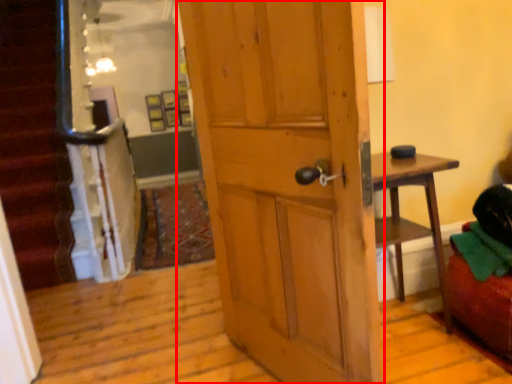
Question: Where is door (annotated by the red box) located in relation to bean bag chair in the image?

Choices:
 (A) left
 (B) right

Answer: (A)